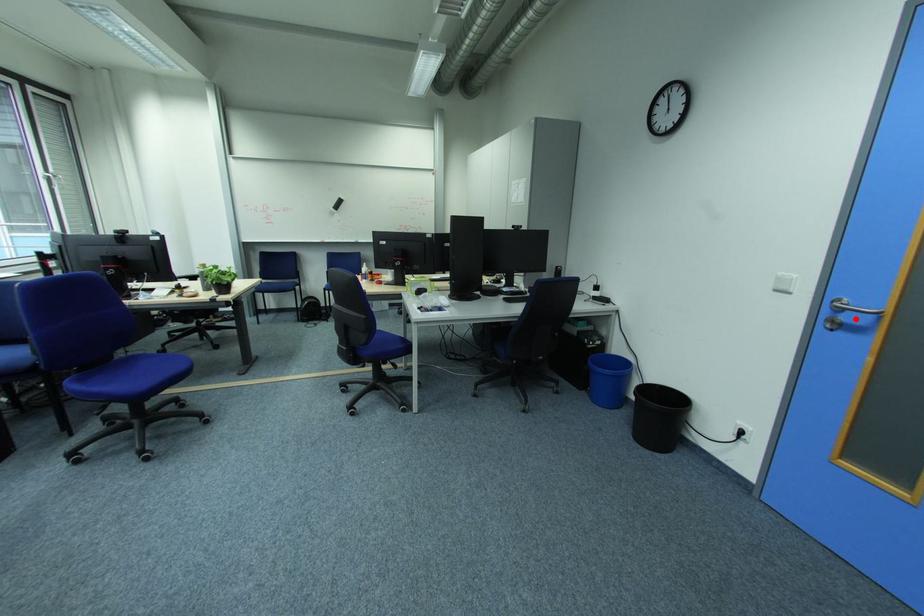
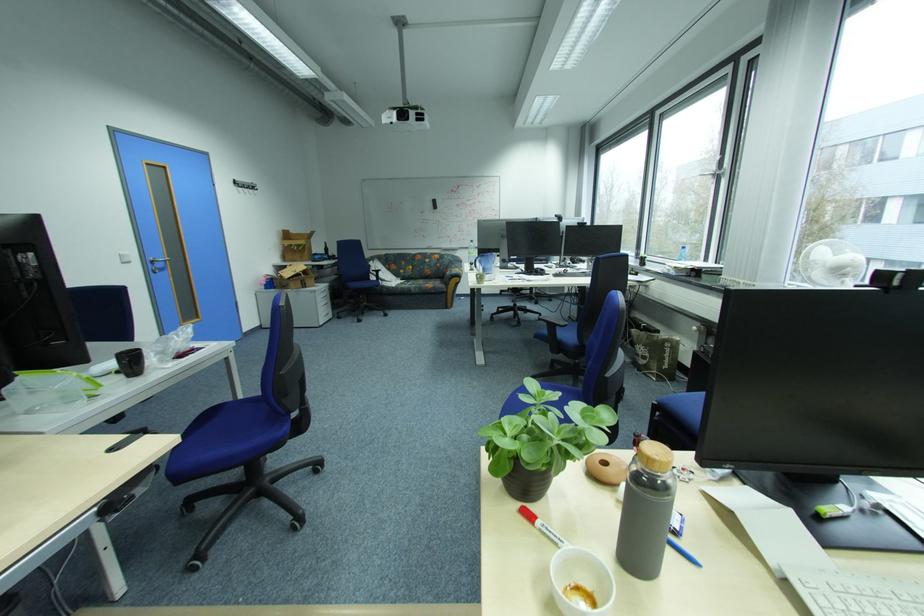
Question: I am providing you with two images of the same scene from different viewpoints. Image1 has a red point marked. In image2, the corresponding 3D location appears at what relative position? Reply with the corresponding letter.

Choices:
 (A) Closer
 (B) Farther

Answer: (A)